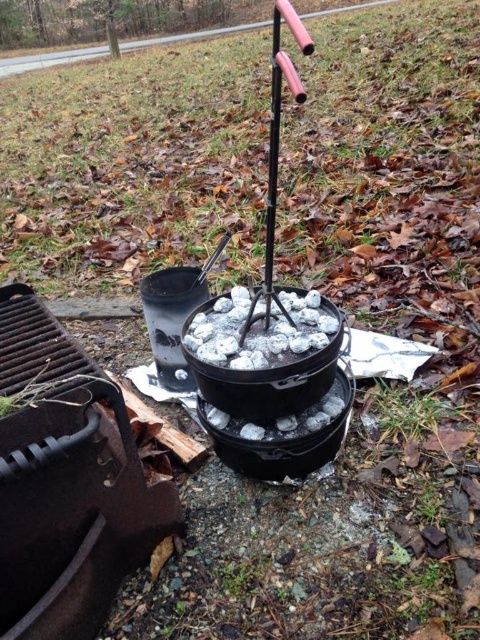
Question: Which point appears farthest from the camera in this image?

Choices:
 (A) (96, 493)
 (B) (326, 310)

Answer: (B)

Question: Is black cast iron grill at lower left to the left of black cast iron pot at center from the viewer's perspective?

Choices:
 (A) no
 (B) yes

Answer: (B)

Question: Can you confirm if black cast iron grill at lower left is bigger than black cast iron pot at center?

Choices:
 (A) yes
 (B) no

Answer: (A)

Question: Among these points, which one is farthest from the camera?

Choices:
 (A) (76, 593)
 (B) (255, 320)

Answer: (B)

Question: Is black cast iron grill at lower left wider than black cast iron pot at center?

Choices:
 (A) yes
 (B) no

Answer: (A)

Question: Which of the following is the farthest from the observer?

Choices:
 (A) (133, 461)
 (B) (236, 310)

Answer: (B)